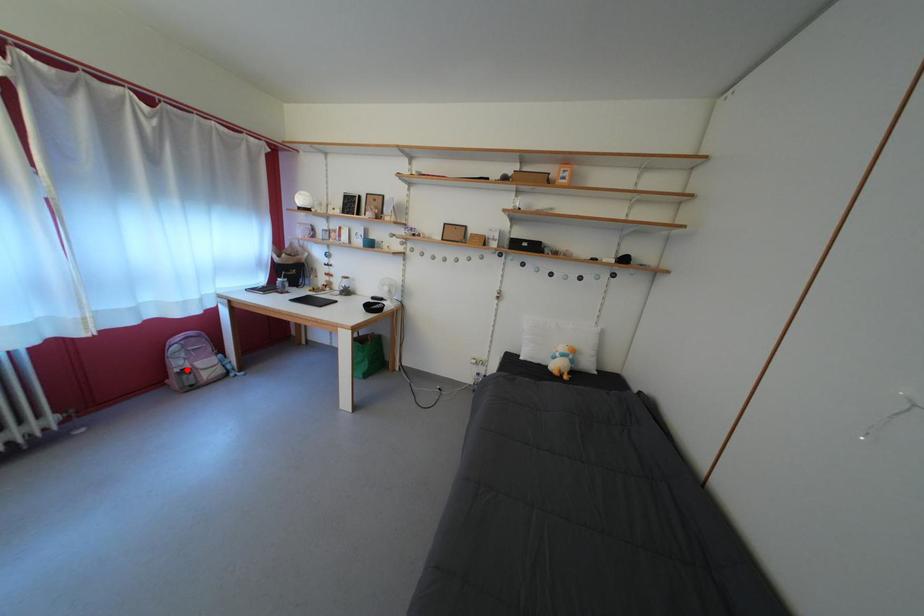
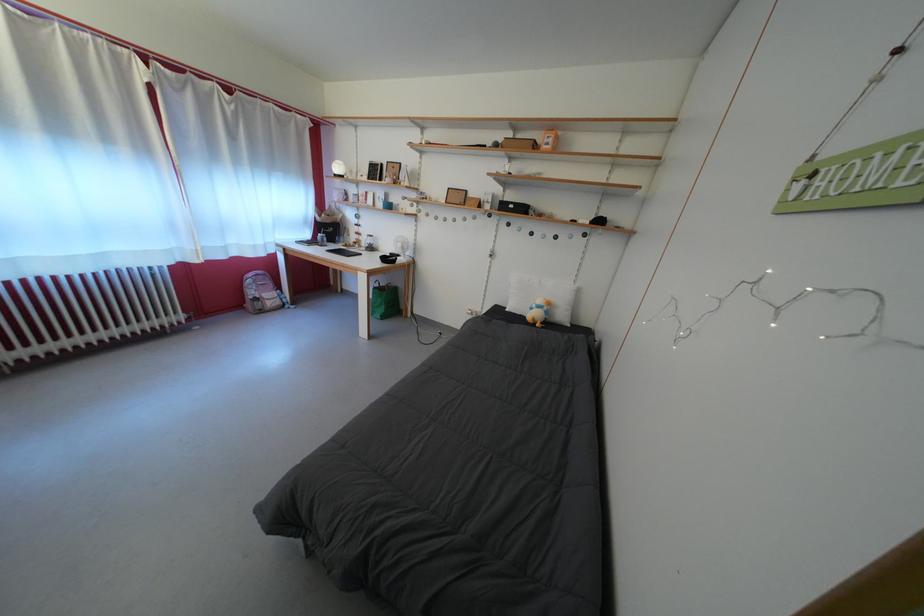
Locate, in the second image, the point that corresponds to the highlighted location in the first image.

(261, 299)